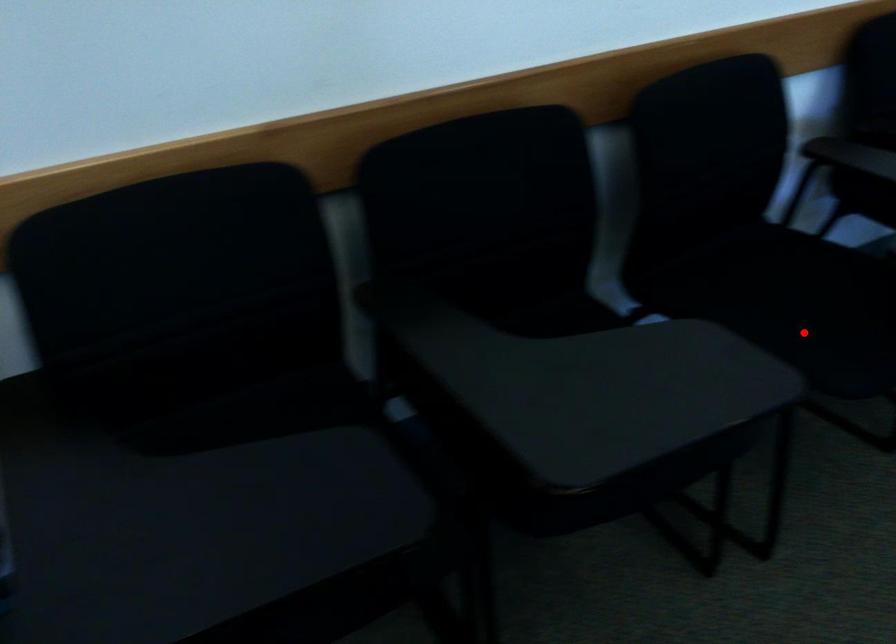
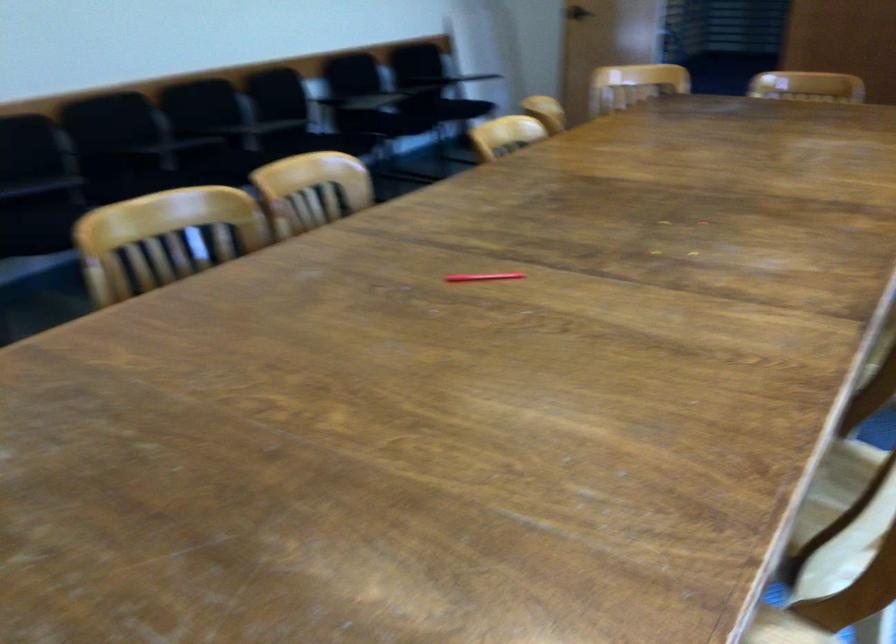
Question: I am providing you with two images of the same scene from different viewpoints. Image1 has a red point marked. In image2, the corresponding 3D location appears at what relative position? Reply with the corresponding letter.

Choices:
 (A) Closer
 (B) Farther

Answer: (B)